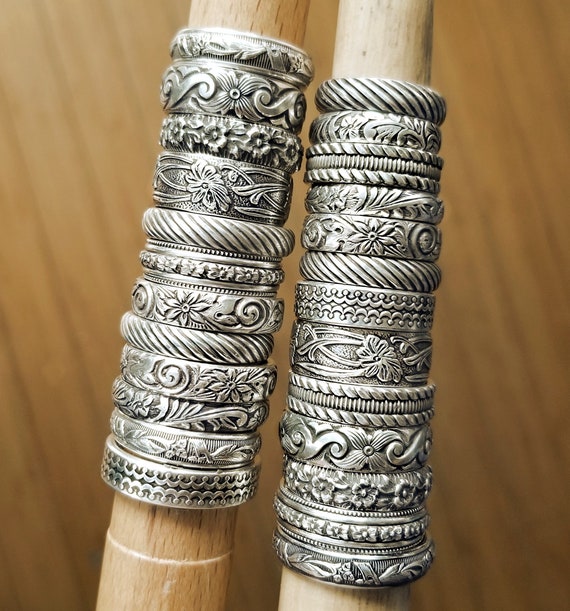
The height and width of the screenshot is (611, 570). Identify the location of floor left side. coord(70,236).